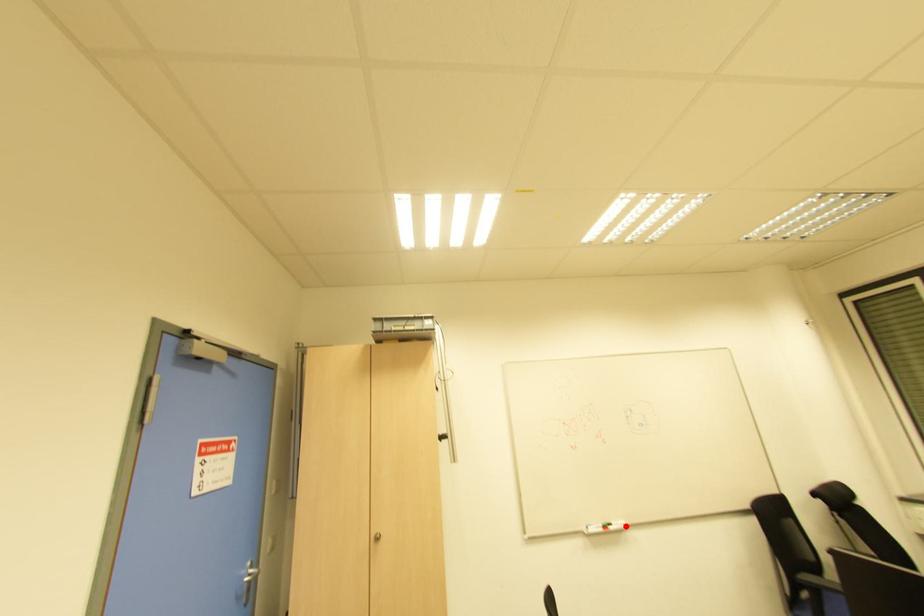
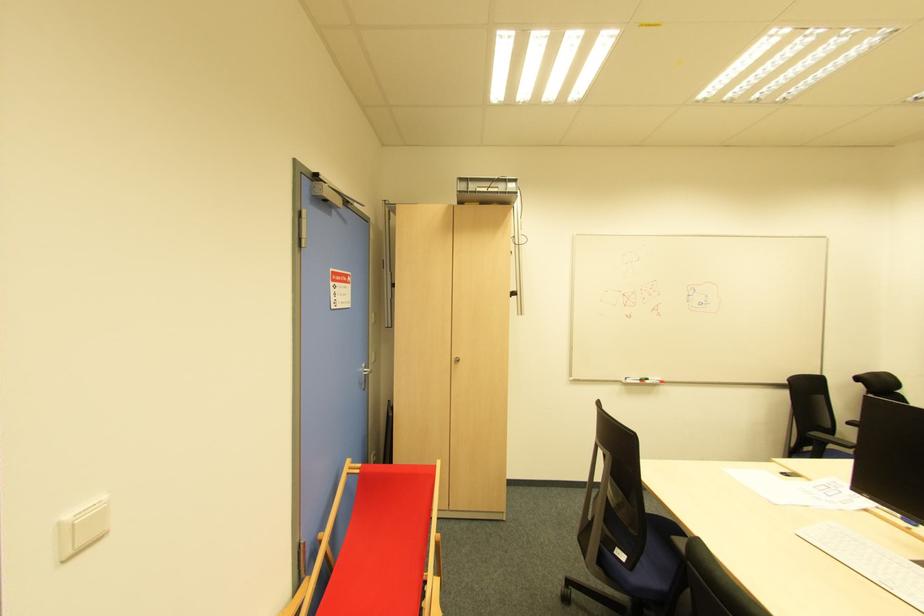
Locate, in the second image, the point that corresponds to the highlighted location in the first image.

(662, 383)